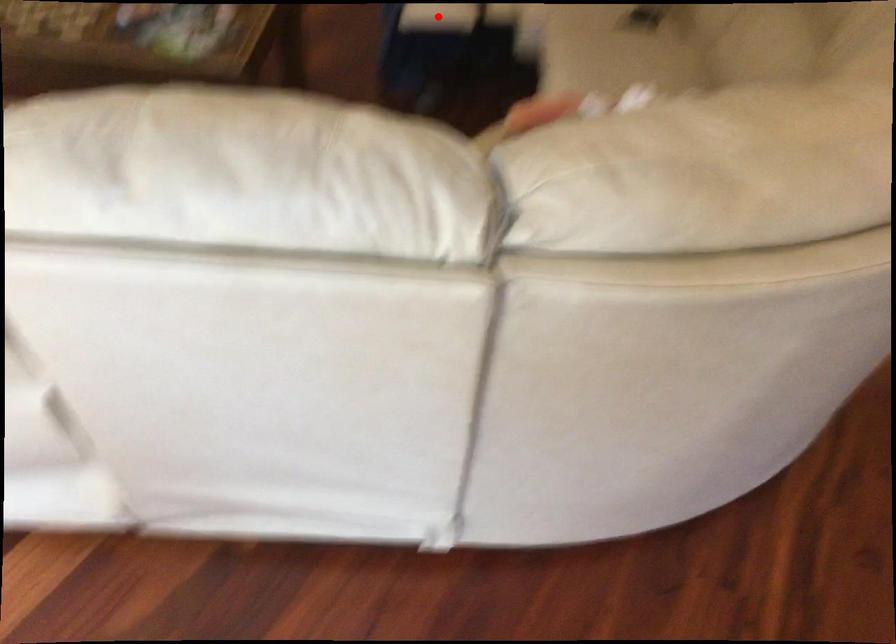
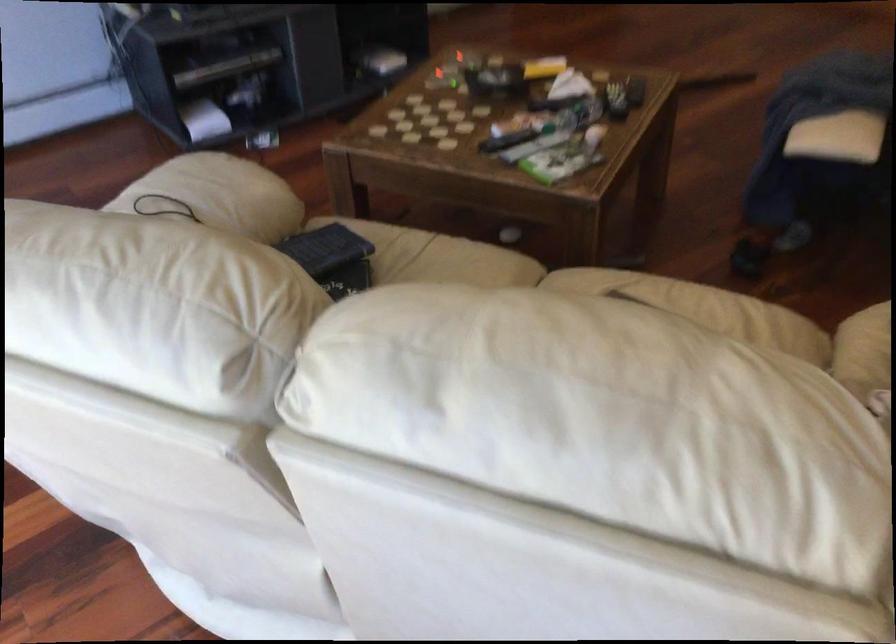
Question: I am providing you with two images of the same scene from different viewpoints. A red point is marked on the first image. At the location where the point appears in image 1, is it still visible in image 2?

Choices:
 (A) Yes
 (B) No

Answer: (B)